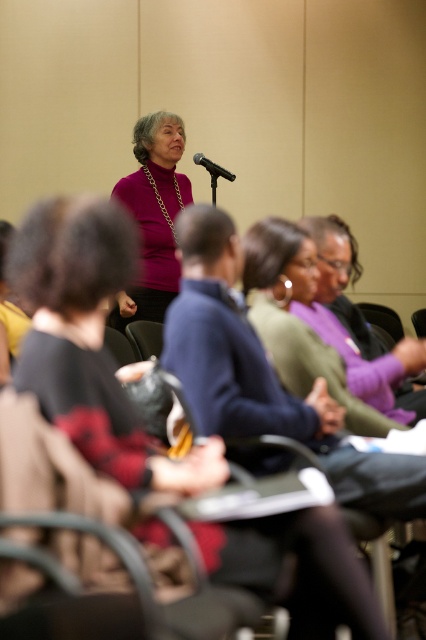
You are an event planner who needs to adjust the lighting in the room to focus attention on the speaker. The purple matte turtleneck sweater at center and the black matte microphone at center are both in the central area. Which object should you adjust the spotlight to highlight first based on their vertical positions?

The purple matte turtleneck sweater at center is below the black matte microphone at center, so you should adjust the spotlight to highlight the black matte microphone at center first since it is higher up.